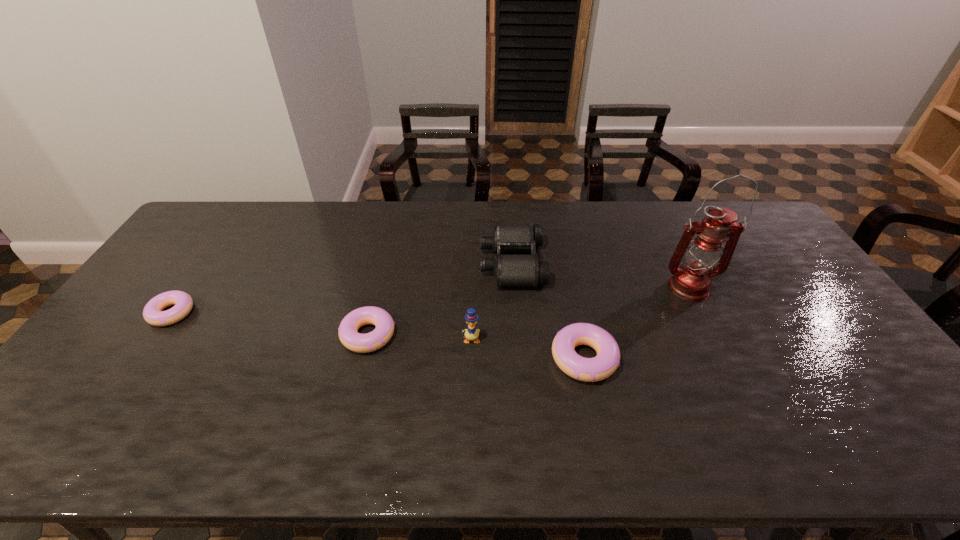
Where is `free spot between the rightmost doughnut and the binoculars`? This screenshot has width=960, height=540. free spot between the rightmost doughnut and the binoculars is located at coordinates (548, 310).

This screenshot has height=540, width=960. I want to click on vacant area that lies between the fourth object from right to left and the binoculars, so click(492, 301).

Image resolution: width=960 pixels, height=540 pixels. I want to click on vacant space in between the rightmost doughnut and the third tallest object, so click(x=548, y=310).

This screenshot has width=960, height=540. I want to click on empty space that is in between the rightmost doughnut and the binoculars, so click(x=548, y=310).

Identify which object is located as the nearest to the second object from left to right. Please provide its 2D coordinates. Your answer should be formatted as a tuple, i.e. [(x, y)], where the tuple contains the x and y coordinates of a point satisfying the conditions above.

[(471, 333)]

Select which object appears as the fourth closest to the third object from left to right. Please provide its 2D coordinates. Your answer should be formatted as a tuple, i.e. [(x, y)], where the tuple contains the x and y coordinates of a point satisfying the conditions above.

[(691, 281)]

What are the coordinates of `doughnut that is the closest to the shortest doughnut` in the screenshot? It's located at (362, 343).

Identify which doughnut is located as the second nearest to the shortest doughnut. Please provide its 2D coordinates. Your answer should be formatted as a tuple, i.e. [(x, y)], where the tuple contains the x and y coordinates of a point satisfying the conditions above.

[(598, 368)]

Identify the location of free space that satisfies the following two spatial constraints: 1. on the face of the second tallest object, where the monocle is placed; 2. on the left side of the rightmost doughnut. (470, 359).

Identify the location of vacant space that satisfies the following two spatial constraints: 1. through the eyepieces of the fourth shortest object; 2. on the face of the duckling, where the monocle is placed. This screenshot has width=960, height=540. (518, 340).